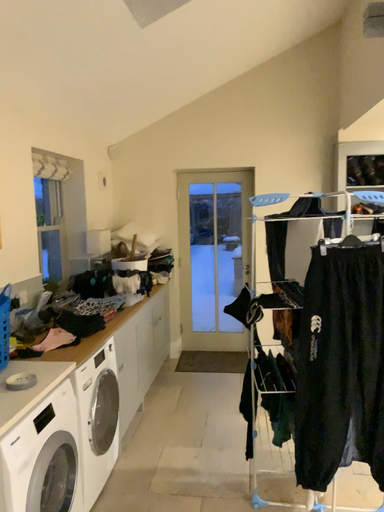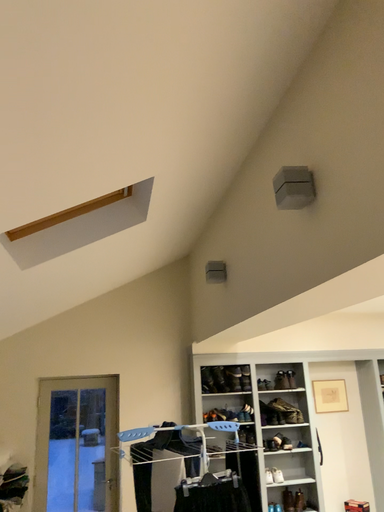
Question: Which way did the camera rotate in the video?

Choices:
 (A) rotated left
 (B) rotated right

Answer: (B)